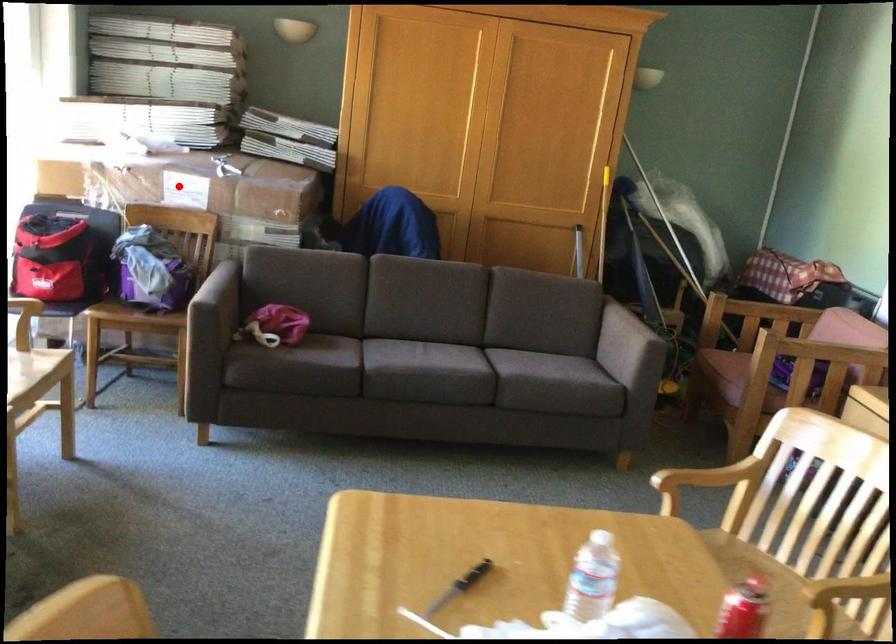
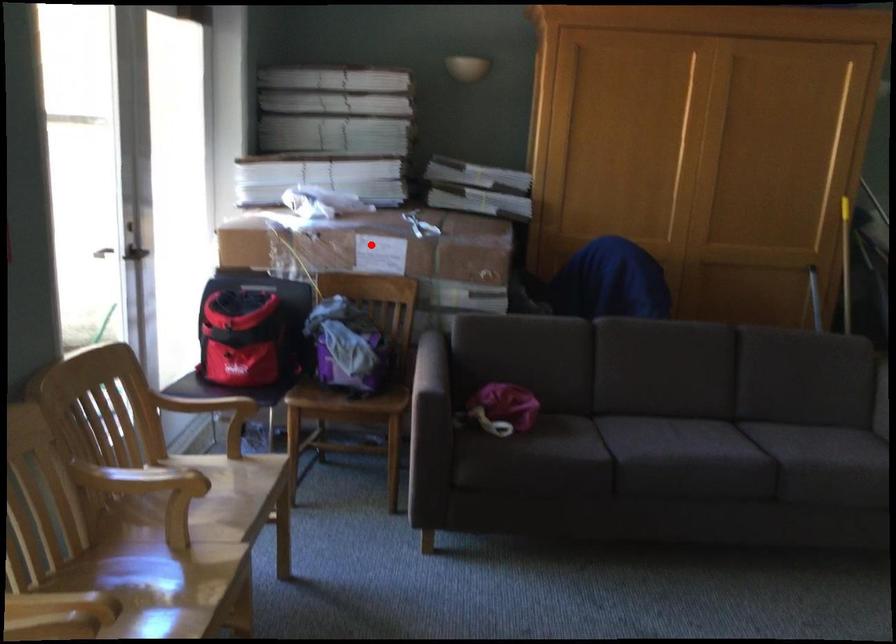
I am providing you with two images of the same scene from different viewpoints. A red point is marked on the first image and another point is marked on the second image. Are the points marked in image1 and image2 representing the same 3D position?

Yes